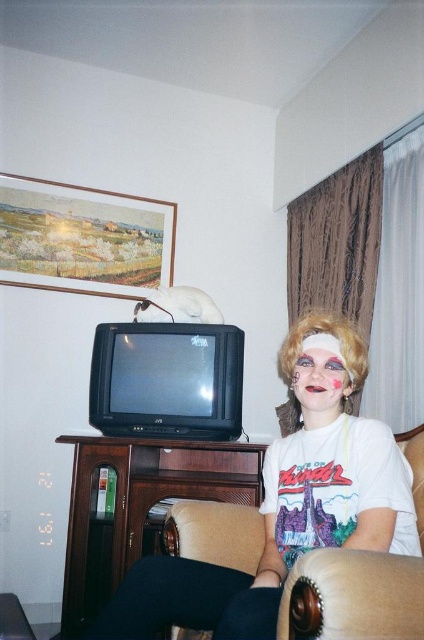
Question: Is white matte wig at upper center behind matte pink makeup at center?

Choices:
 (A) yes
 (B) no

Answer: (B)

Question: Among these objects, which one is farthest from the camera?

Choices:
 (A) white matte wig at upper center
 (B) matte pink makeup at center
 (C) blonde synthetic wig at center

Answer: (C)

Question: Observing the image, what is the correct spatial positioning of white matte wig at upper center in reference to blonde synthetic wig at center?

Choices:
 (A) below
 (B) above

Answer: (A)

Question: Does blonde synthetic wig at center appear over matte pink makeup at center?

Choices:
 (A) yes
 (B) no

Answer: (A)

Question: Which is farther from the blonde synthetic wig at center?

Choices:
 (A) matte pink makeup at center
 (B) white matte wig at upper center

Answer: (B)

Question: Based on their relative distances, which object is farther from the blonde synthetic wig at center?

Choices:
 (A) matte pink makeup at center
 (B) white matte wig at upper center

Answer: (B)